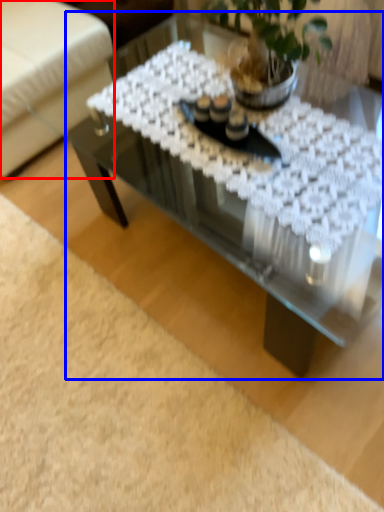
Question: Which object is further to the camera taking this photo, armchair (highlighted by a red box) or coffee table (highlighted by a blue box)?

Choices:
 (A) armchair
 (B) coffee table

Answer: (A)